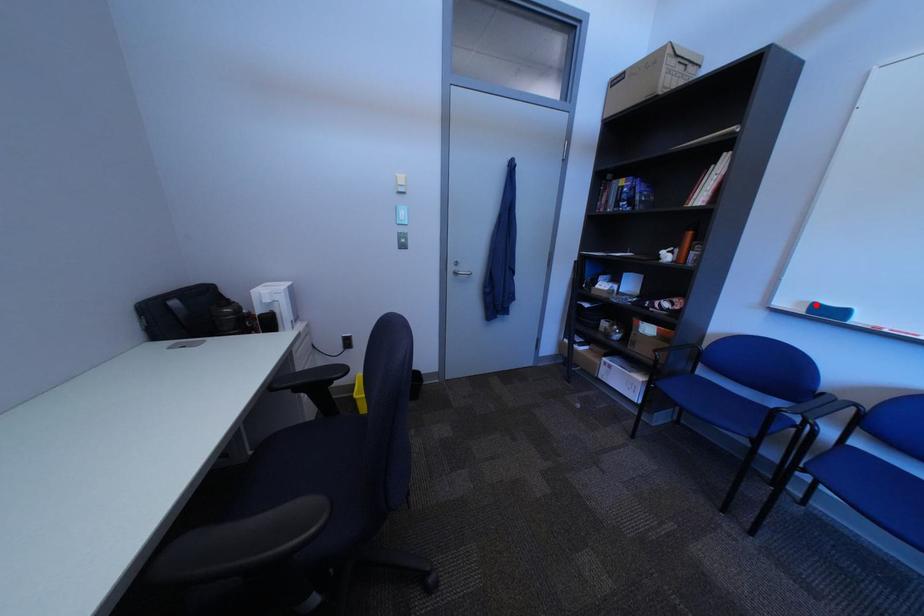
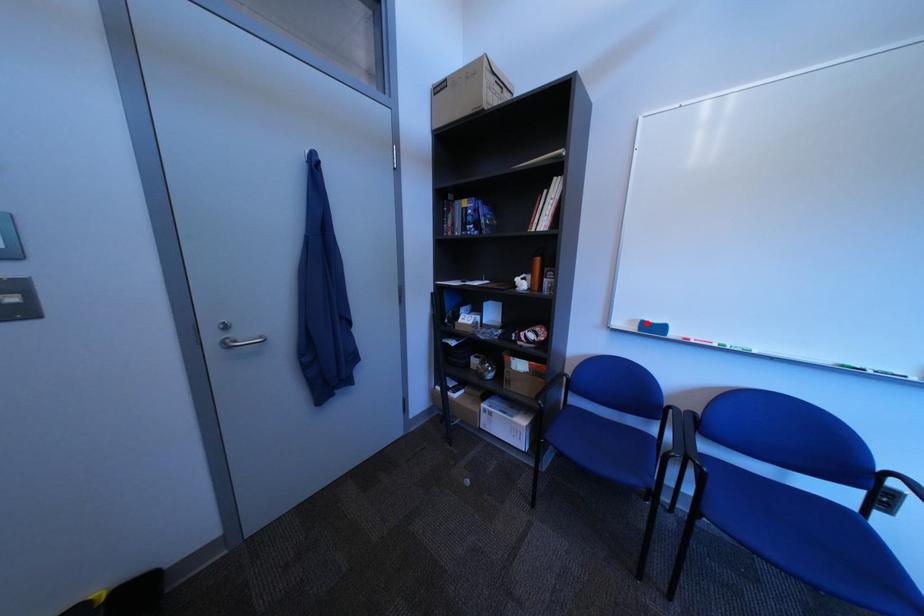
I am providing you with two images of the same scene from different viewpoints. A red point is marked on the first image and another point is marked on the second image. Are the points marked in image1 and image2 representing the same 3D position?

Yes